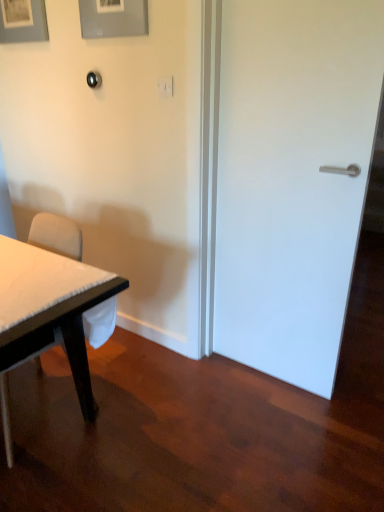
Question: Considering the relative positions of white fabric chair at left and matte gray picture frame at upper left, which is the first picture frame from left to right, in the image provided, is white fabric chair at left to the left or to the right of matte gray picture frame at upper left, which is the first picture frame from left to right,?

Choices:
 (A) right
 (B) left

Answer: (A)

Question: Is white fabric chair at left bigger or smaller than matte gray picture frame at upper left, which is the 2th picture frame in right-to-left order?

Choices:
 (A) small
 (B) big

Answer: (B)

Question: Considering the real-world distances, which object is closest to the white matte door at right?

Choices:
 (A) white fabric chair at left
 (B) matte gray picture frame at upper left, which is the first picture frame from left to right
 (C) matte gray picture frame at upper center, which is the 1th picture frame from right to left

Answer: (C)

Question: Based on their relative distances, which object is farther from the white fabric chair at left?

Choices:
 (A) matte gray picture frame at upper left, which appears as the 1th picture frame when viewed from the back
 (B) white matte door at right
 (C) matte gray picture frame at upper center, which is the 2th picture frame in back-to-front order

Answer: (A)